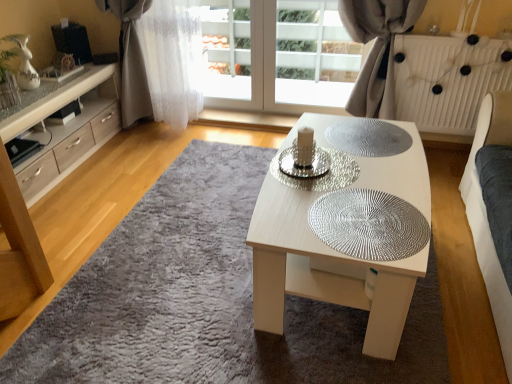
I want to click on free space above white wood coffee table at center (from a real-world perspective), so click(x=352, y=179).